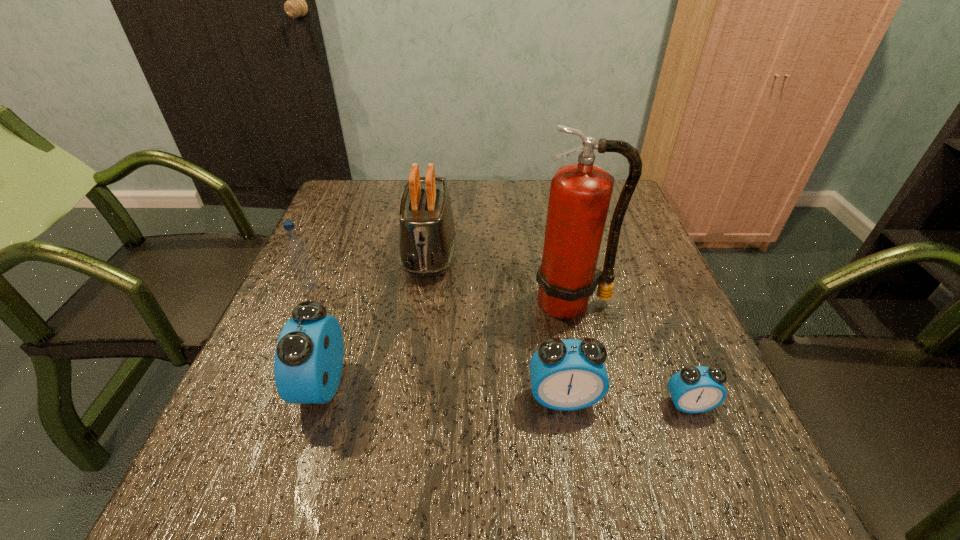
This screenshot has width=960, height=540. I want to click on the fifth object from right to left, so click(308, 362).

I want to click on the second shortest alarm clock, so click(570, 374).

Where is `the second alarm clock from right to left`? This screenshot has height=540, width=960. the second alarm clock from right to left is located at coordinates (570, 374).

Find the location of a particular element. This screenshot has width=960, height=540. the rightmost object is located at coordinates (698, 389).

Identify the location of the shortest object. (698, 389).

In order to click on fire extinguisher in this screenshot , I will do `click(580, 193)`.

At what (x,y) coordinates should I click in order to perform the action: click on the third object from left to right. Please return your answer as a coordinate pair (x, y). The image size is (960, 540). Looking at the image, I should click on (427, 237).

Locate an element on the screen. toaster is located at coordinates (427, 237).

The height and width of the screenshot is (540, 960). I want to click on the leftmost object, so click(296, 248).

I want to click on vacant space situated 0.100m on the face of the fifth object from right to left, so click(251, 385).